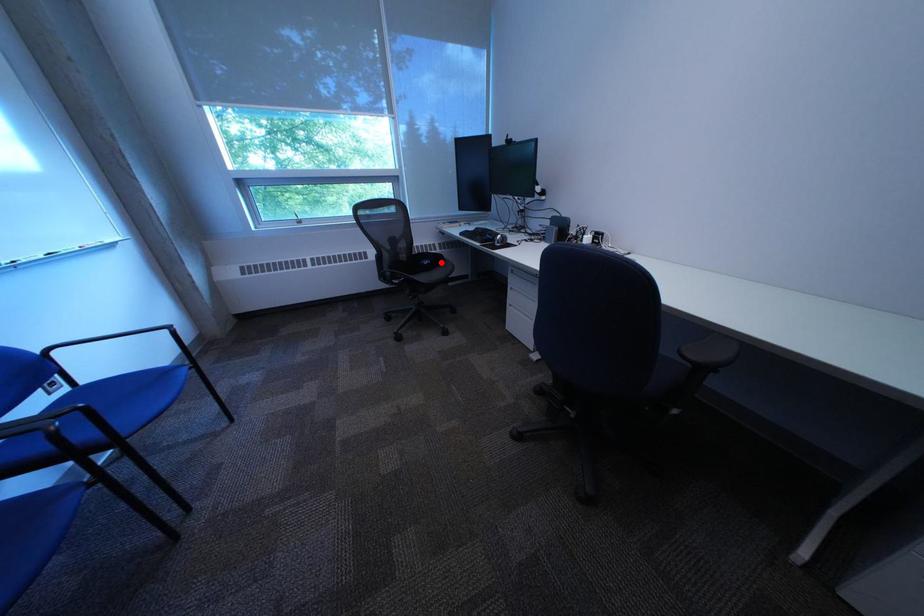
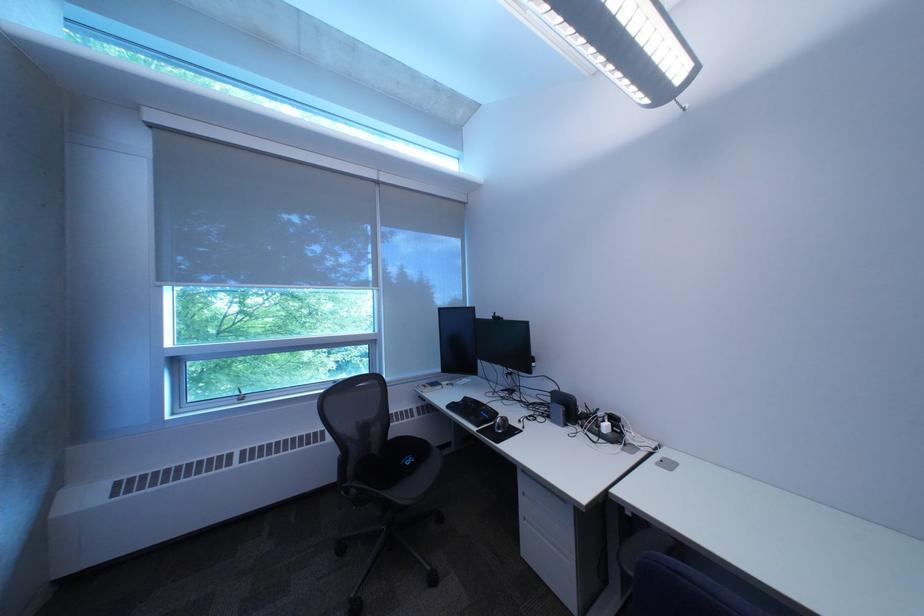
Question: I am providing you with two images of the same scene from different viewpoints. Given a red point in image1, look at the same physical point in image2. Is it:

Choices:
 (A) Closer to the viewpoint
 (B) Farther from the viewpoint

Answer: (B)